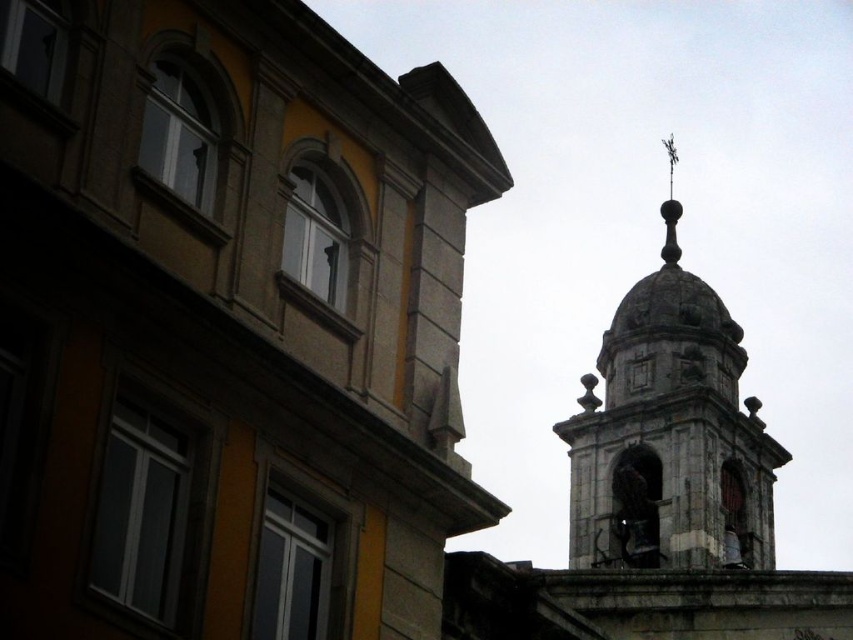
Question: Can you confirm if dark gray stone bell tower at upper right is positioned below polished metal spire at upper center?

Choices:
 (A) yes
 (B) no

Answer: (A)

Question: Can you confirm if dark gray stone bell tower at upper right is positioned below polished metal spire at upper center?

Choices:
 (A) yes
 (B) no

Answer: (A)

Question: Can you confirm if dark gray stone bell tower at upper right is positioned above polished metal spire at upper center?

Choices:
 (A) no
 (B) yes

Answer: (A)

Question: Which of the following is the farthest from the observer?

Choices:
 (A) (669, 234)
 (B) (732, 484)

Answer: (A)